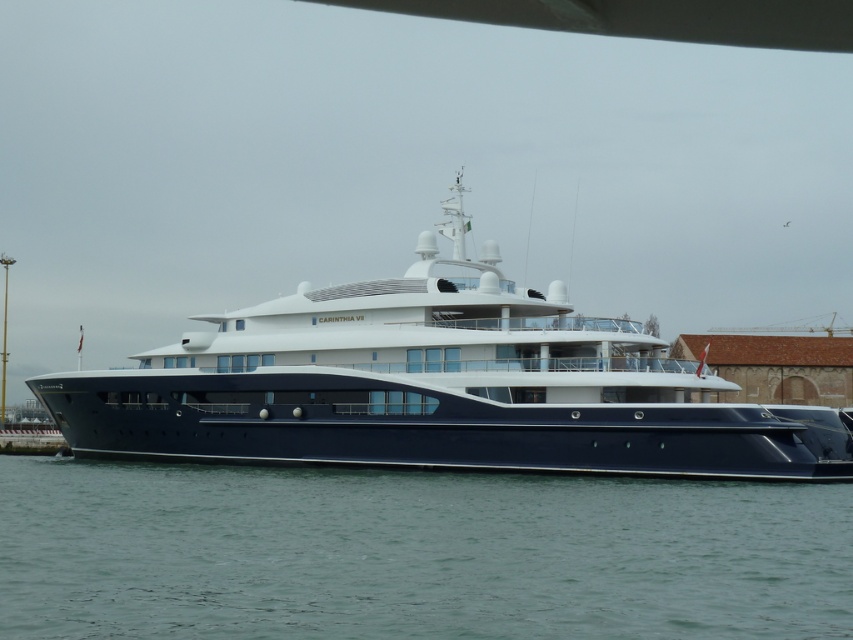
Question: Which object appears closest to the camera in this image?

Choices:
 (A) shiny blue yacht at center
 (B) green water at lower center

Answer: (B)

Question: Is green water at lower center to the right of shiny blue yacht at center from the viewer's perspective?

Choices:
 (A) yes
 (B) no

Answer: (A)

Question: Can you confirm if green water at lower center is positioned to the left of shiny blue yacht at center?

Choices:
 (A) no
 (B) yes

Answer: (A)

Question: Where is green water at lower center located in relation to shiny blue yacht at center in the image?

Choices:
 (A) above
 (B) below

Answer: (B)

Question: Which point appears closest to the camera in this image?

Choices:
 (A) (439, 618)
 (B) (648, 371)

Answer: (A)